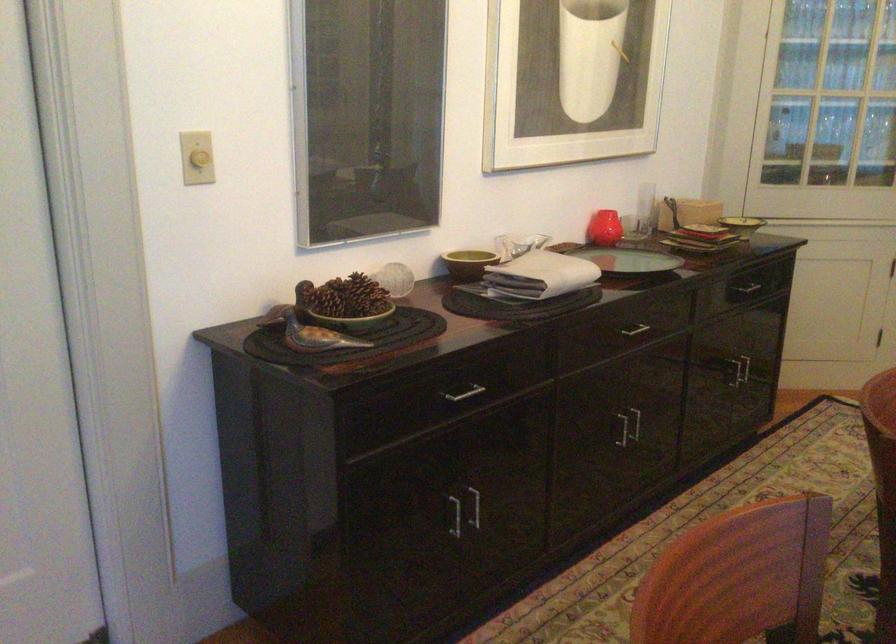
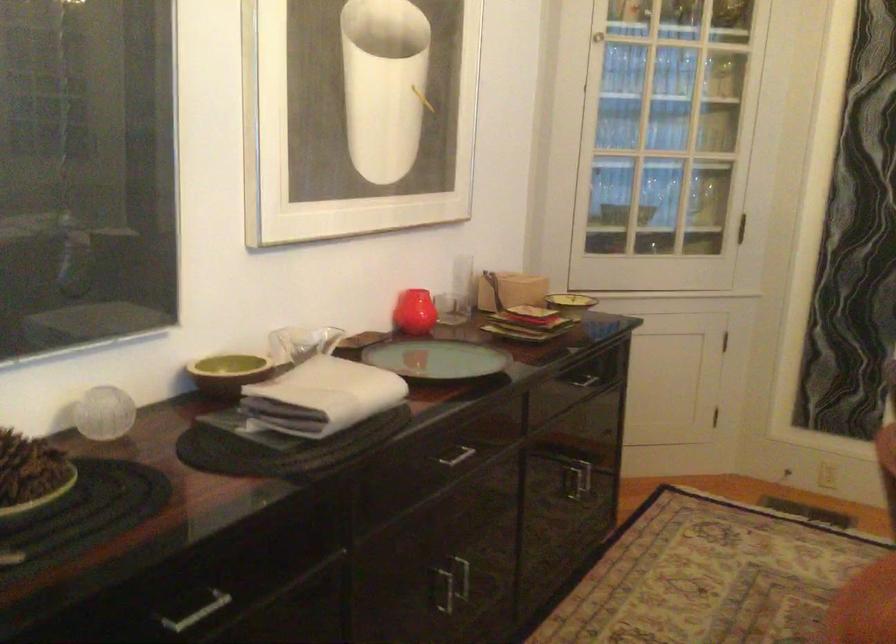
Locate, in the second image, the point that corresponds to [469,260] in the first image.

(228, 373)